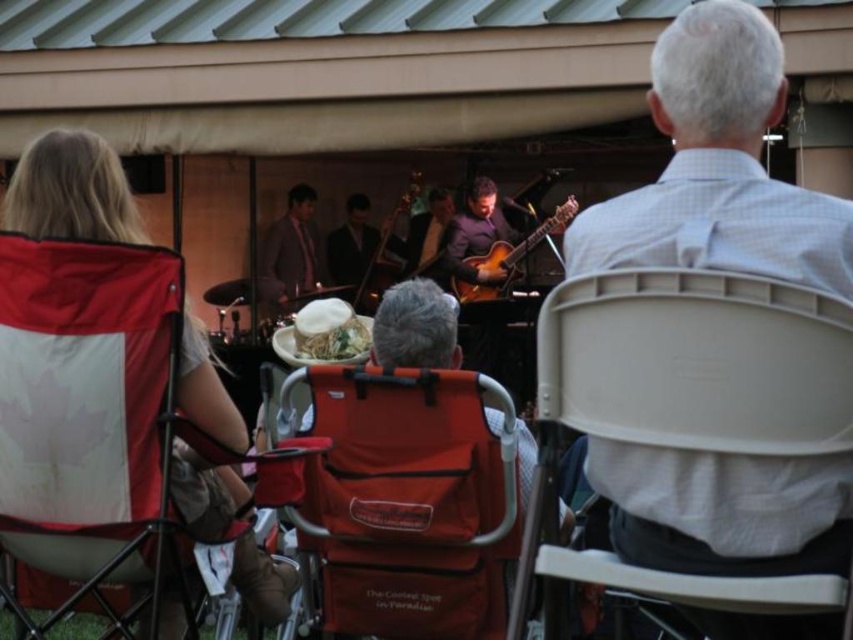
You are sitting in the front row of the outdoor musical performance. You want to take a photo of the wooden upright bass at center without the matte red folding chair at center blocking your view. Is it possible?

The matte red folding chair at center is closer to the viewer than the wooden upright bass at center, so the chair would block the view of the bass. It is not possible to take a photo of the wooden upright bass at center without the chair blocking it.

You are a photographer at the event and want to capture a photo of the glossy wood guitar at center without any obstruction. Considering the red fabric chair at left, is there any part of the chair blocking the view of the guitar?

The red fabric chair at left is in front of the glossy wood guitar at center, so it is blocking the view of the guitar. To capture an unobstructed photo of the glossy wood guitar at center, you would need to move around or behind the red fabric chair at left.